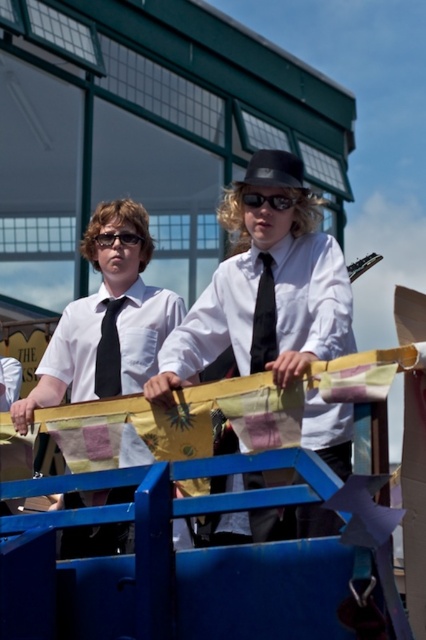
Can you confirm if matte black shirt at center is positioned below black satin tie at center?

Yes, matte black shirt at center is below black satin tie at center.

Is point (106, 384) in front of point (273, 300)?

No, it is behind (273, 300).

Locate an element on the screen. This screenshot has width=426, height=640. matte black shirt at center is located at coordinates (106, 320).

Who is positioned more to the left, matte black shirt at center or black matte tie at center?

From the viewer's perspective, black matte tie at center appears more on the left side.

This screenshot has width=426, height=640. Describe the element at coordinates (106, 320) in the screenshot. I see `matte black shirt at center` at that location.

The width and height of the screenshot is (426, 640). Describe the element at coordinates (106, 320) in the screenshot. I see `matte black shirt at center` at that location.

Identify the location of matte black shirt at center. This screenshot has height=640, width=426. (106, 320).

Which is in front, point (256, 353) or point (106, 394)?

Point (256, 353) is more forward.

Between black satin tie at center and black matte tie at center, which one appears on the right side from the viewer's perspective?

From the viewer's perspective, black satin tie at center appears more on the right side.

Which is behind, point (268, 278) or point (112, 394)?

The point (112, 394) is behind.

The image size is (426, 640). I want to click on black satin tie at center, so pos(264,317).